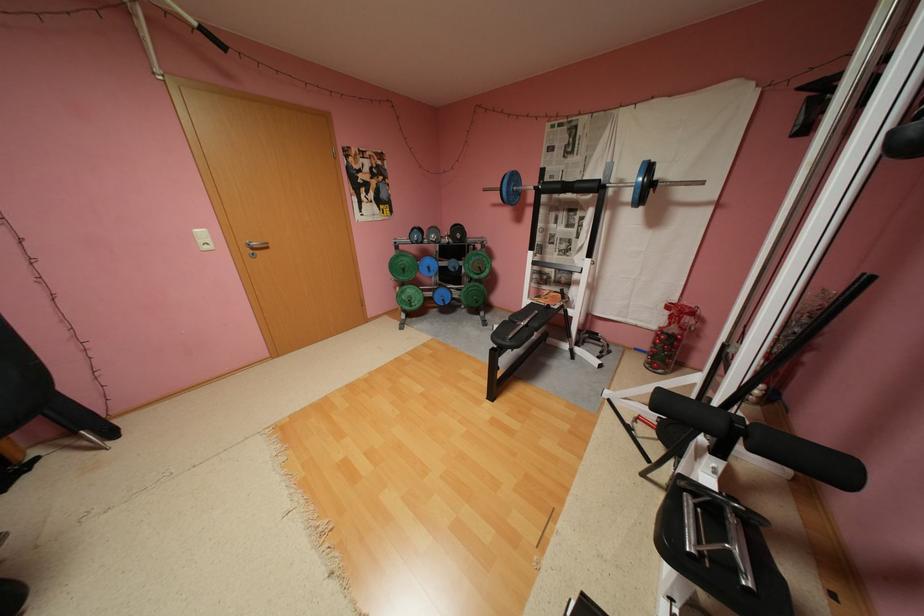
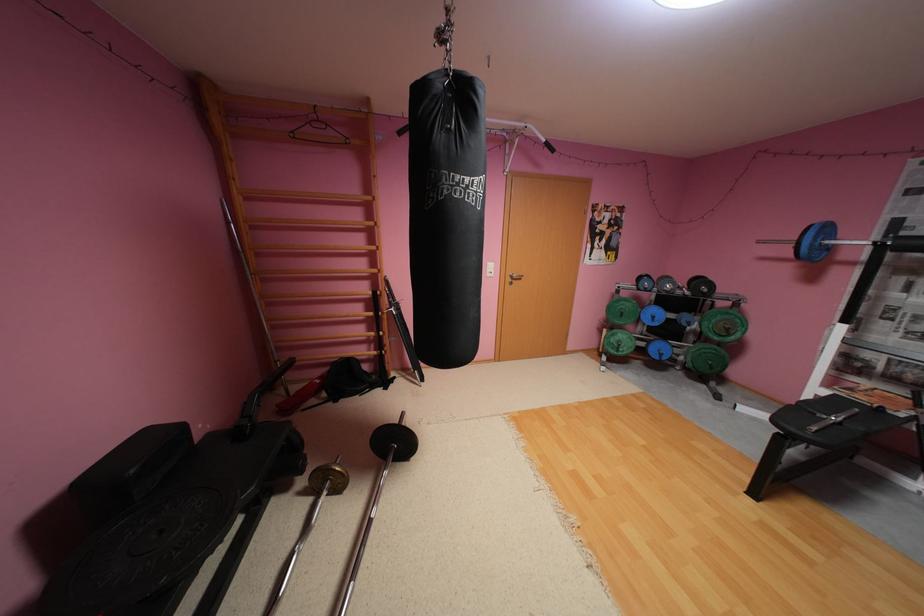
Question: The camera is either moving clockwise (left) or counter-clockwise (right) around the object. The first image is from the beginning of the video and the second image is from the end. Is the camera moving left or right when shooting the video?

Choices:
 (A) Left
 (B) Right

Answer: (B)